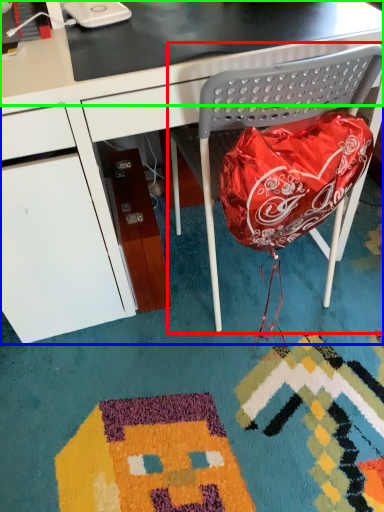
Question: Based on their relative distances, which object is farther from folding chair (highlighted by a red box)? Choose from desk (highlighted by a blue box) and table top (highlighted by a green box).

Choices:
 (A) desk
 (B) table top

Answer: (A)